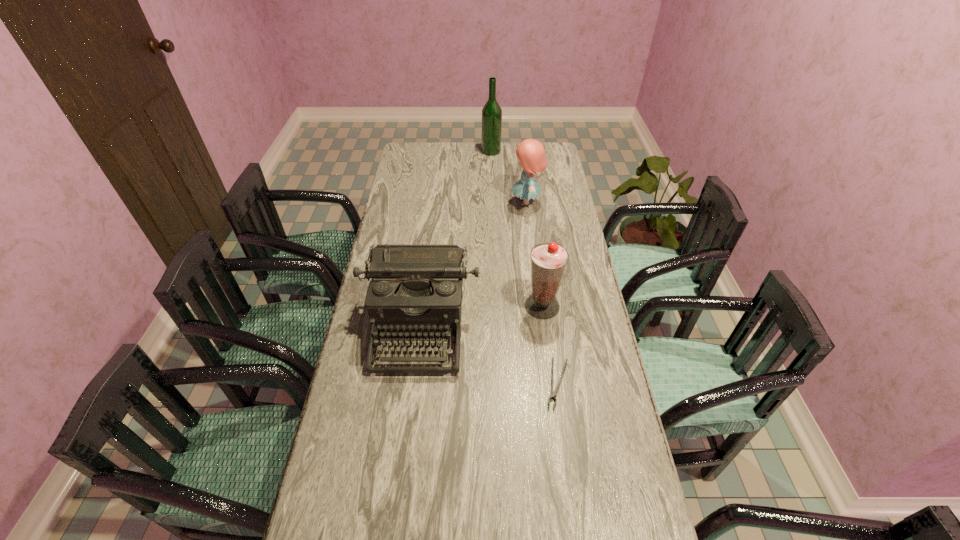
Locate an element on the screen. This screenshot has height=540, width=960. vacant space at the left edge is located at coordinates (346, 379).

I want to click on vacant space at the right edge, so click(549, 190).

In the image, there is a desktop. Where is `free space at the far left corner`? This screenshot has width=960, height=540. free space at the far left corner is located at coordinates (412, 157).

Locate an element on the screen. This screenshot has height=540, width=960. free spot between the shortest object and the smoothie is located at coordinates (550, 345).

The height and width of the screenshot is (540, 960). What are the coordinates of `empty space between the leftmost object and the smoothie` in the screenshot? It's located at (481, 317).

Where is `free space between the second shortest object and the shortest object`? Image resolution: width=960 pixels, height=540 pixels. free space between the second shortest object and the shortest object is located at coordinates pos(489,355).

The width and height of the screenshot is (960, 540). What are the coordinates of `vacant region between the second object from left to right and the typewriter` in the screenshot? It's located at (455, 239).

Locate an element on the screen. The image size is (960, 540). free space between the typewriter and the shortest object is located at coordinates (489, 355).

Identify the location of unoccupied position between the shortest object and the alcohol. (x=524, y=267).

Identify the location of vacant area between the leftmost object and the second farthest object. This screenshot has height=540, width=960. (473, 265).